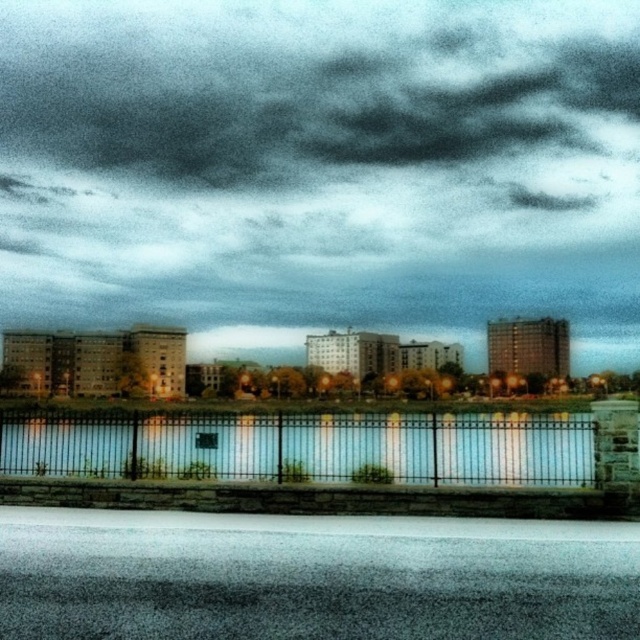
Question: Which point is closer to the camera?

Choices:
 (A) (637, 237)
 (B) (292, 460)

Answer: (B)

Question: Does dark gray cloud at upper center have a lesser width compared to black metal fence at center?

Choices:
 (A) yes
 (B) no

Answer: (B)

Question: Does dark gray cloud at upper center have a greater width compared to black metal fence at center?

Choices:
 (A) yes
 (B) no

Answer: (A)

Question: Can you confirm if dark gray cloud at upper center is wider than black metal fence at center?

Choices:
 (A) yes
 (B) no

Answer: (A)

Question: Which of the following is the closest to the observer?

Choices:
 (A) (420, 28)
 (B) (97, 413)

Answer: (B)

Question: Which object appears closest to the camera in this image?

Choices:
 (A) black metal fence at center
 (B) dark gray cloud at upper center

Answer: (A)